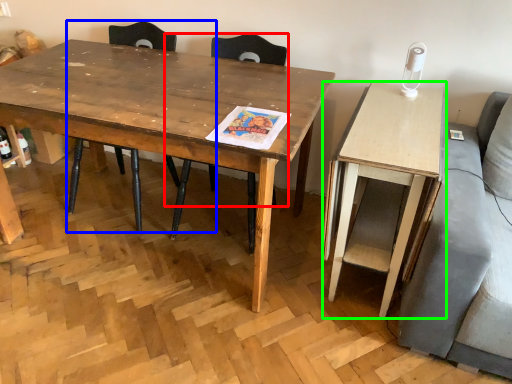
Question: Which object is the farthest from chair (highlighted by a red box)? Choose among these: chair (highlighted by a blue box) or desk (highlighted by a green box).

Choices:
 (A) chair
 (B) desk

Answer: (B)